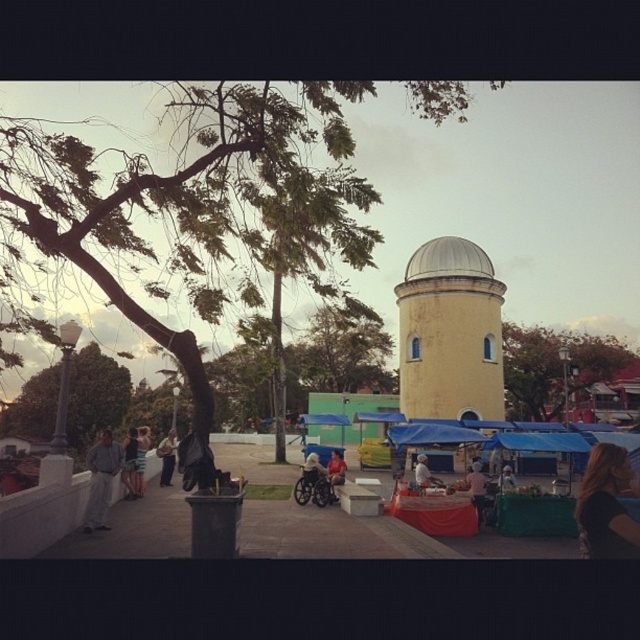
Question: Is light blue jeans at left closer to camera compared to pink fabric at center?

Choices:
 (A) no
 (B) yes

Answer: (B)

Question: In this image, where is blue tarpaulin at center located relative to black plastic bag at lower center?

Choices:
 (A) above
 (B) below

Answer: (A)

Question: Is green leafy tree at upper left to the left of light blue jeans at left from the viewer's perspective?

Choices:
 (A) yes
 (B) no

Answer: (B)

Question: Considering the real-world distances, which object is farthest from the dark gray fabric bag at lower left?

Choices:
 (A) light brown fabric bag at lower center
 (B) black plastic bag at lower center

Answer: (A)

Question: Which object is farther from the camera taking this photo?

Choices:
 (A) white fabric umbrella at center
 (B) blonde hair at lower right
 (C) light brown fabric bag at lower center

Answer: (A)

Question: Which object is positioned closest to the green leafy tree at left?

Choices:
 (A) blue tarpaulin canopy at center
 (B) light brown leather jacket at center

Answer: (A)